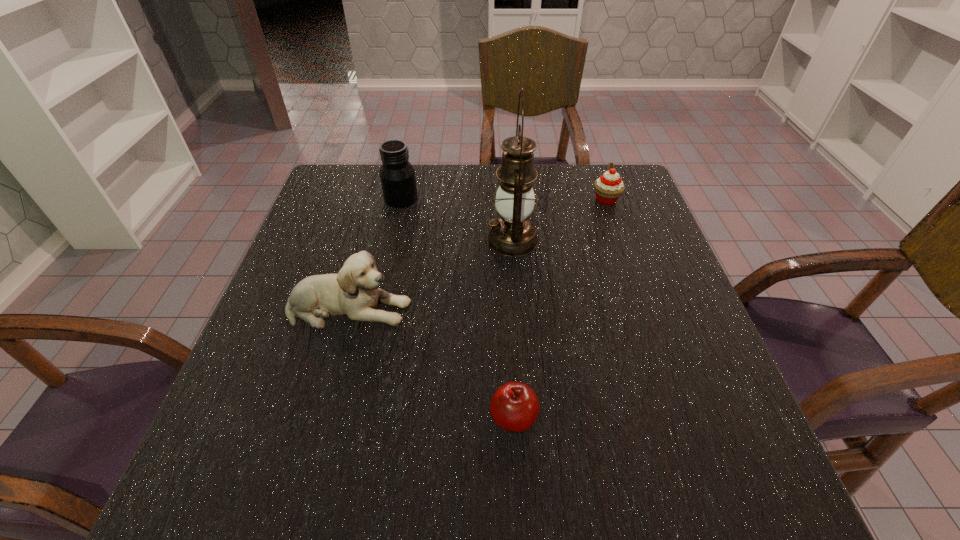
Where is `blank space at the near edge of the desktop`? blank space at the near edge of the desktop is located at coordinates (499, 462).

What are the coordinates of `vacant region at the right edge of the desktop` in the screenshot? It's located at (615, 278).

Find the location of `vacant space at the near left corner of the desktop`. vacant space at the near left corner of the desktop is located at coordinates (255, 477).

In the image, there is a desktop. In order to click on vacant space at the far right corner in this screenshot , I will do `click(644, 207)`.

Find the location of a particular element. free space at the near right corner of the desktop is located at coordinates (762, 501).

Find the location of a particular element. The image size is (960, 540). free space between the apple and the oil lamp is located at coordinates (513, 329).

What are the coordinates of `vacant area between the jar and the oil lamp` in the screenshot? It's located at (457, 220).

I want to click on vacant area between the oil lamp and the jar, so click(x=457, y=220).

This screenshot has height=540, width=960. I want to click on unoccupied position between the fourth farthest object and the tallest object, so click(x=431, y=274).

Find the location of `blank region between the nearest object and the jar`. blank region between the nearest object and the jar is located at coordinates (457, 308).